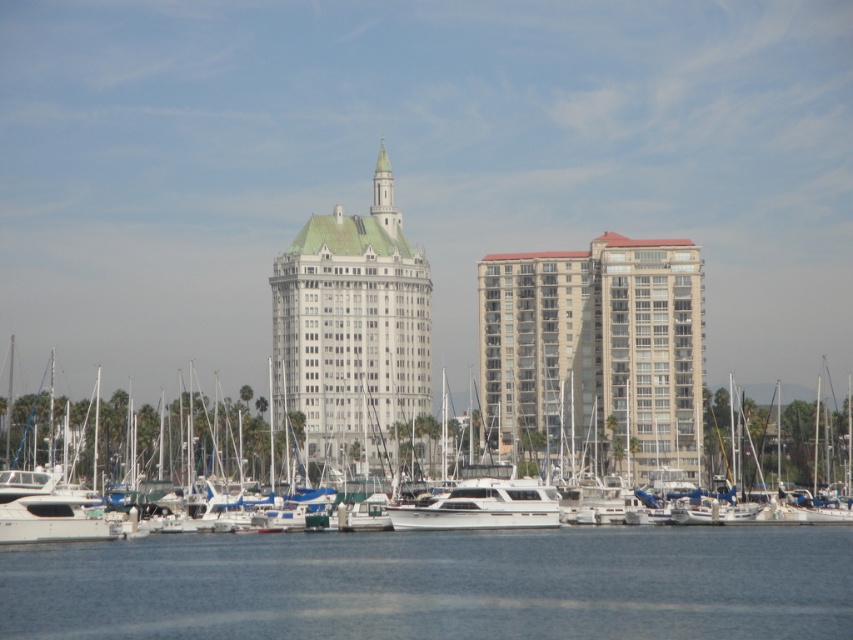
In the scene shown: What are the coordinates of the clear blue water at lower center in the image?

The clear blue water at lower center is located at coordinates point (438, 584).

From the picture: You are standing on the dock and see the clear blue water at lower center and the white glossy yacht at center. Which object is located below the other?

The clear blue water at lower center is positioned under the white glossy yacht at center.

You are standing on the dock at the waterfront marina and want to know how far the white smooth building at center is from you. Can you determine the distance?

The white smooth building at center is 210.39 meters away from the viewer, so the distance is 210.39 meters.